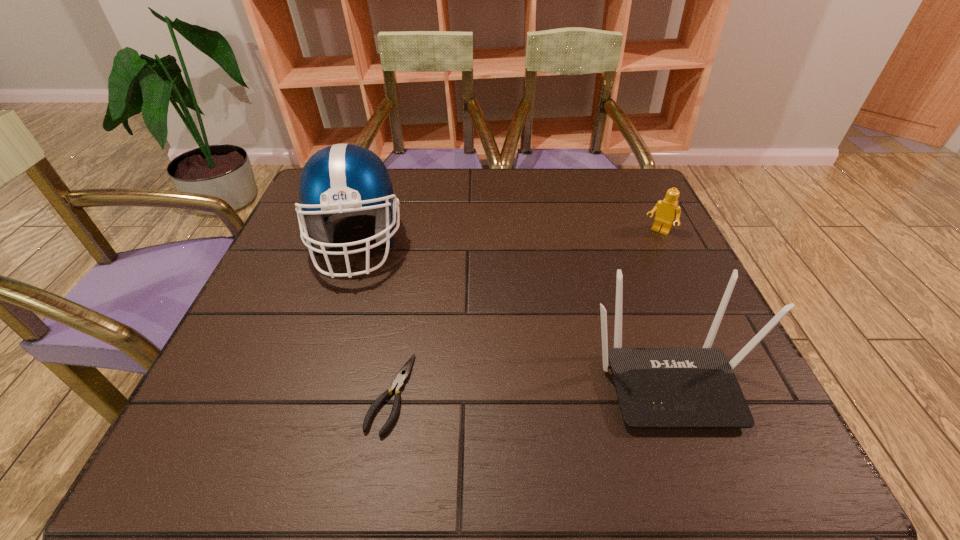
The width and height of the screenshot is (960, 540). In order to click on pliers in this screenshot , I will do `click(403, 374)`.

At what (x,y) coordinates should I click in order to perform the action: click on router. Please return your answer as a coordinate pair (x, y). The image size is (960, 540). Looking at the image, I should click on (656, 387).

Identify the location of the tallest object. The height and width of the screenshot is (540, 960). (343, 180).

At what (x,y) coordinates should I click in order to perform the action: click on Lego. Please return your answer as a coordinate pair (x, y). Looking at the image, I should click on (668, 209).

Where is `vacant point located 0.160m on the right of the shortest object`? This screenshot has width=960, height=540. vacant point located 0.160m on the right of the shortest object is located at coordinates (502, 394).

Image resolution: width=960 pixels, height=540 pixels. Identify the location of free space located 0.100m at the front of the tallest object with the faceguard. (414, 295).

The width and height of the screenshot is (960, 540). Identify the location of free spot located at the front of the tallest object with the faceguard. (454, 324).

I want to click on vacant area located at the front of the tallest object with the faceguard, so click(480, 342).

At what (x,y) coordinates should I click in order to perform the action: click on free location located on the face of the Lego. Please return your answer as a coordinate pair (x, y). This screenshot has height=540, width=960. Looking at the image, I should click on (x=644, y=251).

Find the location of `free region located on the face of the Lego`. free region located on the face of the Lego is located at coordinates (600, 313).